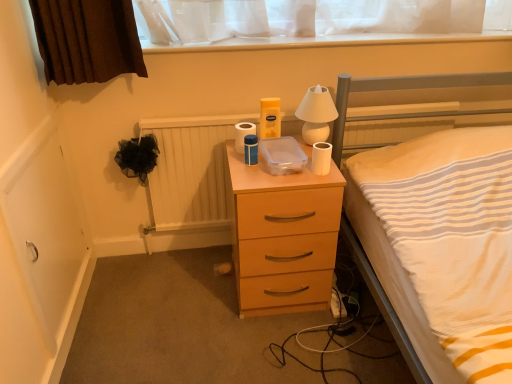
Question: Could you tell me if white glossy lamp at upper center is facing white matte toilet paper at center, arranged as the second toilet paper when viewed from the right?

Choices:
 (A) yes
 (B) no

Answer: (B)

Question: From the image's perspective, would you say white glossy lamp at upper center is positioned over white matte toilet paper at center, arranged as the second toilet paper when viewed from the right?

Choices:
 (A) yes
 (B) no

Answer: (A)

Question: From the image's perspective, does white glossy lamp at upper center appear lower than white matte toilet paper at center, acting as the first toilet paper starting from the left?

Choices:
 (A) no
 (B) yes

Answer: (A)

Question: Considering the relative sizes of white glossy lamp at upper center and white matte toilet paper at center, which is the 1th toilet paper from back to front, in the image provided, is white glossy lamp at upper center wider than white matte toilet paper at center, which is the 1th toilet paper from back to front,?

Choices:
 (A) yes
 (B) no

Answer: (A)

Question: Does white glossy lamp at upper center have a larger size compared to white matte toilet paper at center, arranged as the second toilet paper when viewed from the right?

Choices:
 (A) no
 (B) yes

Answer: (B)

Question: Is white glossy lamp at upper center next to white matte toilet paper at center, acting as the first toilet paper starting from the left, and touching it?

Choices:
 (A) no
 (B) yes

Answer: (A)

Question: From a real-world perspective, is matte wood chest of drawers at center under white matte toilet paper at center, which is the 2th toilet paper in front-to-back order?

Choices:
 (A) yes
 (B) no

Answer: (A)

Question: Does matte wood chest of drawers at center have a lesser width compared to white matte toilet paper at center, arranged as the second toilet paper when viewed from the right?

Choices:
 (A) yes
 (B) no

Answer: (B)

Question: From the image's perspective, is matte wood chest of drawers at center located above white matte toilet paper at center, which is the 1th toilet paper from back to front?

Choices:
 (A) no
 (B) yes

Answer: (A)

Question: Considering the relative sizes of matte wood chest of drawers at center and white matte toilet paper at center, which is the 1th toilet paper from back to front, in the image provided, is matte wood chest of drawers at center smaller than white matte toilet paper at center, which is the 1th toilet paper from back to front,?

Choices:
 (A) yes
 (B) no

Answer: (B)

Question: Is there a large distance between matte wood chest of drawers at center and white matte toilet paper at center, which is the 1th toilet paper from back to front?

Choices:
 (A) yes
 (B) no

Answer: (B)

Question: Does matte wood chest of drawers at center come in front of white matte toilet paper at center, arranged as the second toilet paper when viewed from the right?

Choices:
 (A) no
 (B) yes

Answer: (B)

Question: Is white glossy lamp at upper center facing towards wooden radiator at center?

Choices:
 (A) no
 (B) yes

Answer: (A)